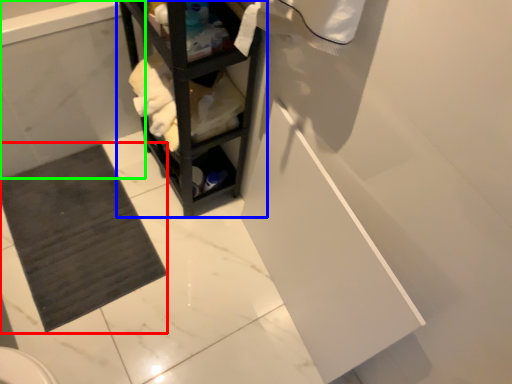
Question: Which object is the closest to the bath mat (highlighted by a red box)? Choose among these: shelf (highlighted by a blue box) or bath (highlighted by a green box).

Choices:
 (A) shelf
 (B) bath

Answer: (B)